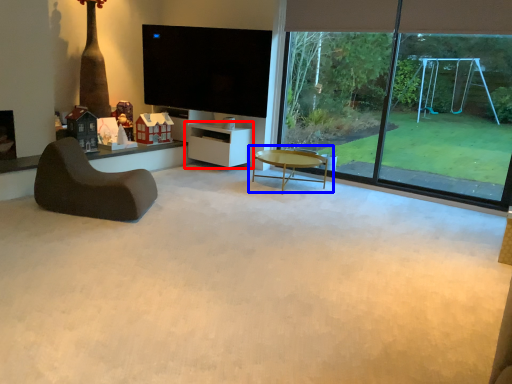
Question: Which object is further to the camera taking this photo, shelf (highlighted by a red box) or coffee table (highlighted by a blue box)?

Choices:
 (A) shelf
 (B) coffee table

Answer: (A)